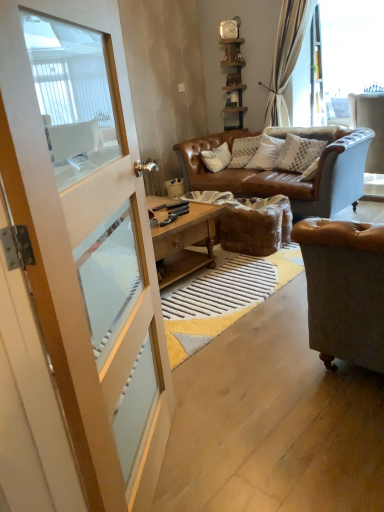
You are a GUI agent. You are given a task and a screenshot of the screen. Output one action in this format:
    pyautogui.click(x=<x>, y=<y>)
    Task: Click on the vacant space underneath white wood screen door at left (from a real-world perspective)
    This screenshot has width=384, height=512.
    Given the screenshot: What is the action you would take?
    pyautogui.click(x=160, y=456)